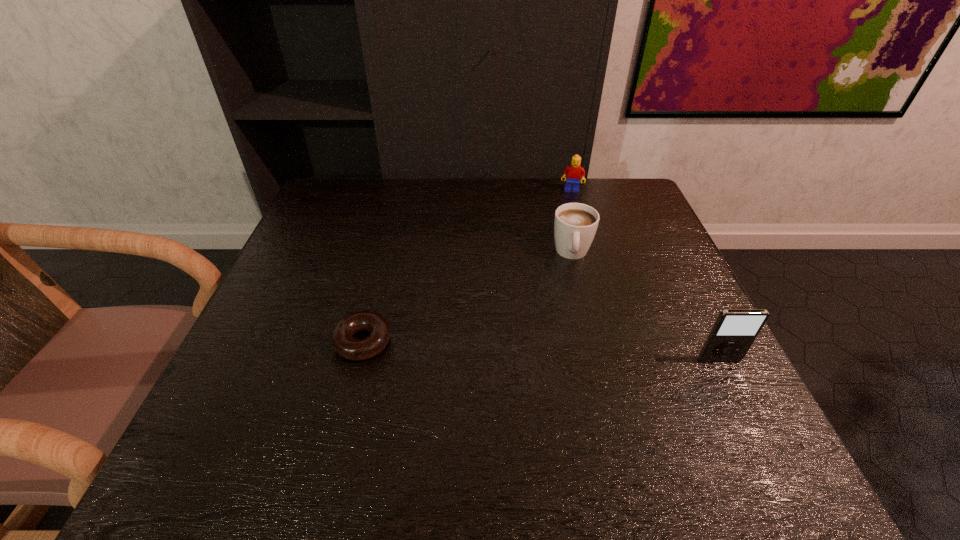
Locate an element on the screen. doughnut is located at coordinates (347, 346).

Find the location of a particular element. the leftmost object is located at coordinates (347, 346).

This screenshot has height=540, width=960. In order to click on iPod in this screenshot , I will do `click(735, 330)`.

Where is `the rightmost object`? This screenshot has height=540, width=960. the rightmost object is located at coordinates (735, 330).

This screenshot has width=960, height=540. In order to click on the third nearest object in this screenshot , I will do click(x=575, y=225).

I want to click on Lego, so click(x=574, y=172).

Locate an element on the screen. free space located on the right of the doughnut is located at coordinates (436, 342).

Image resolution: width=960 pixels, height=540 pixels. I want to click on vacant space located 0.100m on the front-facing side of the iPod, so pyautogui.click(x=744, y=410).

This screenshot has width=960, height=540. I want to click on vacant space located with the handle on the side of the cappuccino, so click(572, 404).

Where is `vacant space located with the handle on the side of the cappuccino`? vacant space located with the handle on the side of the cappuccino is located at coordinates (573, 355).